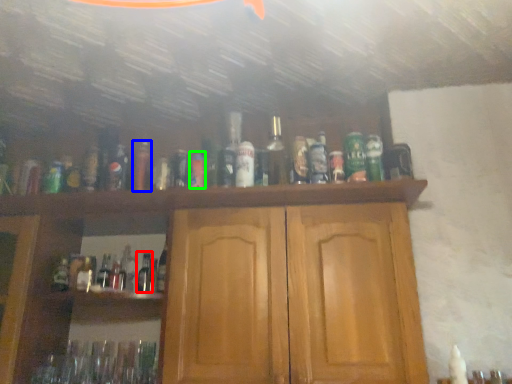
Question: Which object is the farthest from bottle (highlighted by a red box)? Choose among these: bottle (highlighted by a blue box) or bottle (highlighted by a green box).

Choices:
 (A) bottle
 (B) bottle

Answer: (B)